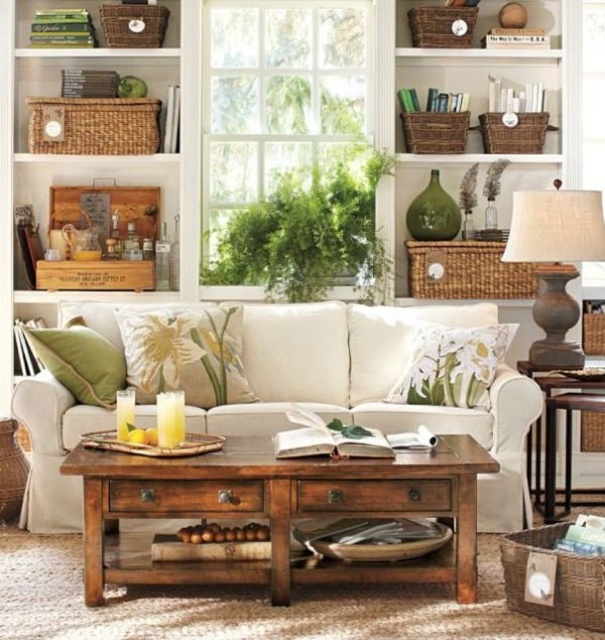
Question: Is rustic wood couch at center to the right of white wooden window at center from the viewer's perspective?

Choices:
 (A) no
 (B) yes

Answer: (B)

Question: Can you confirm if rustic wood coffee table at center is positioned to the right of rustic wicker basket at upper right?

Choices:
 (A) yes
 (B) no

Answer: (B)

Question: Which object is farther from the camera taking this photo?

Choices:
 (A) matte gray lamp at right
 (B) floral-patterned fabric pillow at center

Answer: (A)

Question: Among these points, which one is nearest to the camera?

Choices:
 (A) tap(370, 204)
 (B) tap(90, 394)
 (C) tap(273, 497)

Answer: (C)

Question: Based on their relative distances, which object is nearer to the rustic wicker basket at upper right?

Choices:
 (A) rustic wood couch at center
 (B) floral-patterned fabric pillow at center
 (C) green matte bookshelf at upper left

Answer: (B)

Question: Can you confirm if green leafy plant at center is thinner than floral fabric pillow at center?

Choices:
 (A) yes
 (B) no

Answer: (B)